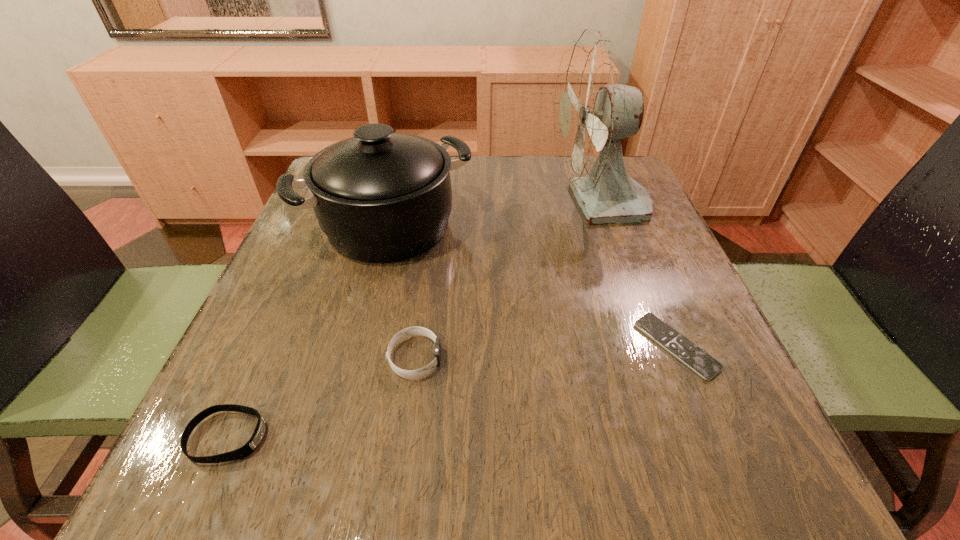
The image size is (960, 540). What are the coordinates of `remote control that is at the right edge` in the screenshot? It's located at (696, 359).

Where is `object that is at the far left corner`? object that is at the far left corner is located at coordinates (380, 197).

Find the location of `object that is at the near left corner`. object that is at the near left corner is located at coordinates (251, 445).

This screenshot has height=540, width=960. I want to click on object positioned at the far right corner, so click(x=593, y=110).

Image resolution: width=960 pixels, height=540 pixels. Find the location of `blank space at the near edge`. blank space at the near edge is located at coordinates (314, 460).

The image size is (960, 540). In the image, there is a desktop. Identify the location of vacant space at the left edge. (227, 416).

Where is `blank space at the right edge of the desktop`? The height and width of the screenshot is (540, 960). blank space at the right edge of the desktop is located at coordinates (705, 314).

Identify the location of free space at the near left corner of the desktop. (267, 474).

Where is `free location at the near right corner of the desktop`? free location at the near right corner of the desktop is located at coordinates (760, 440).

I want to click on free space between the saucepan and the left wristband, so click(308, 331).